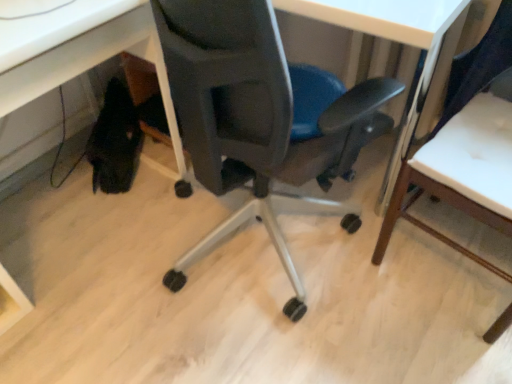
Question: Can you confirm if matte black chair at lower left is bigger than matte black chair at center, which is the first chair from left to right?

Choices:
 (A) no
 (B) yes

Answer: (A)

Question: Is matte black chair at lower left facing away from matte black chair at center, which is the first chair from left to right?

Choices:
 (A) yes
 (B) no

Answer: (B)

Question: Considering the relative sizes of matte black chair at lower left and matte black chair at center, which is the first chair from left to right, in the image provided, is matte black chair at lower left thinner than matte black chair at center, which is the first chair from left to right,?

Choices:
 (A) no
 (B) yes

Answer: (B)

Question: From a real-world perspective, is matte black chair at lower left positioned over matte black chair at center, which is the first chair from left to right, based on gravity?

Choices:
 (A) yes
 (B) no

Answer: (B)

Question: From the image's perspective, does matte black chair at lower left appear lower than matte black chair at center, which is the first chair from left to right?

Choices:
 (A) no
 (B) yes

Answer: (B)

Question: Is matte black chair at lower left bigger or smaller than matte black chair at center, which is counted as the 2th chair, starting from the right?

Choices:
 (A) big
 (B) small

Answer: (B)

Question: Is point (98, 62) positioned closer to the camera than point (230, 221)?

Choices:
 (A) farther
 (B) closer

Answer: (B)

Question: Would you say matte black chair at lower left is inside or outside matte black chair at center, which is counted as the 2th chair, starting from the right?

Choices:
 (A) inside
 (B) outside

Answer: (B)

Question: In terms of width, does matte black chair at lower left look wider or thinner when compared to matte black chair at center, which is the first chair from left to right?

Choices:
 (A) wide
 (B) thin

Answer: (B)

Question: Do you think wooden chair at right, the 2th chair in the left-to-right sequence, is within matte black chair at center, which is counted as the 2th chair, starting from the right, or outside of it?

Choices:
 (A) inside
 (B) outside

Answer: (B)

Question: Is point (485, 67) closer or farther from the camera than point (187, 125)?

Choices:
 (A) farther
 (B) closer

Answer: (A)

Question: From the image's perspective, is wooden chair at right, the 2th chair in the left-to-right sequence, above or below matte black chair at center, which is counted as the 2th chair, starting from the right?

Choices:
 (A) above
 (B) below

Answer: (B)

Question: Is wooden chair at right, the first chair viewed from the right, wider or thinner than matte black chair at center, which is the first chair from left to right?

Choices:
 (A) thin
 (B) wide

Answer: (A)

Question: Considering the positions of point (160, 13) and point (470, 62), is point (160, 13) closer or farther from the camera than point (470, 62)?

Choices:
 (A) closer
 (B) farther

Answer: (A)

Question: Looking at their shapes, would you say matte black chair at center, which is counted as the 2th chair, starting from the right, is wider or thinner than wooden chair at right, the first chair viewed from the right?

Choices:
 (A) thin
 (B) wide

Answer: (B)